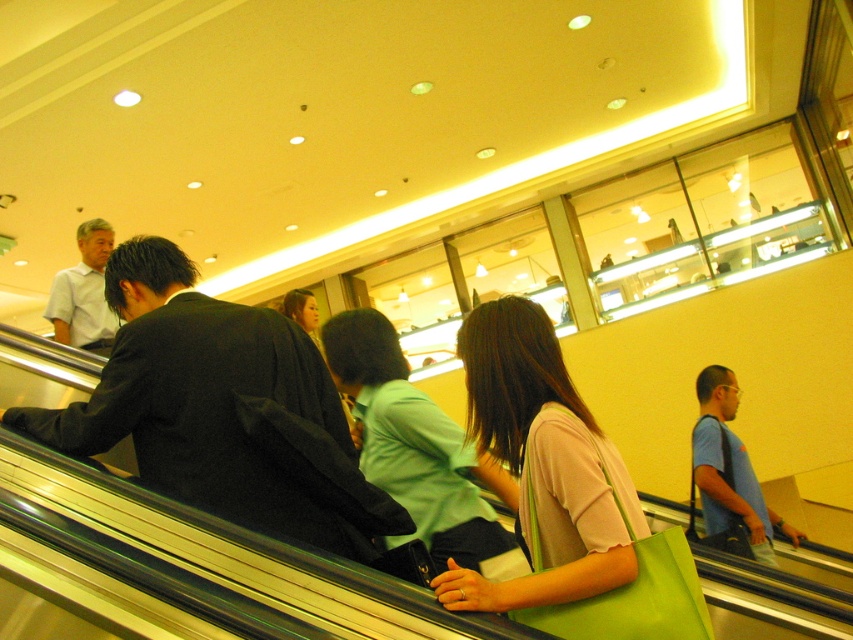
You are standing at the entrance of the mall and want to locate the pink fabric bag at center. According to the coordinates provided, in which direction should you look relative to the escalator?

The pink fabric bag at center is located at coordinates point (541, 465), which means it is positioned to the right and slightly forward of the escalator.

You are a security guard in the mall and need to ensure that the black matte jacket at left and the white shirt at left do not block the escalator entrance. Based on their positions, which one is closer to the entrance and might need to be addressed first?

The black matte jacket at left is wider than the white shirt at left, so it might be blocking more of the entrance and should be addressed first to ensure clear access.

You are a delivery robot that is 1.8 meters tall. You need to move through the space between the black matte jacket at left and the white shirt at left. Can you pass through this space without bending down?

The distance between the black matte jacket at left and the white shirt at left is 1.96 meters. Since the robot is 1.8 meters tall, it can pass through the space without bending down as the height is sufficient.